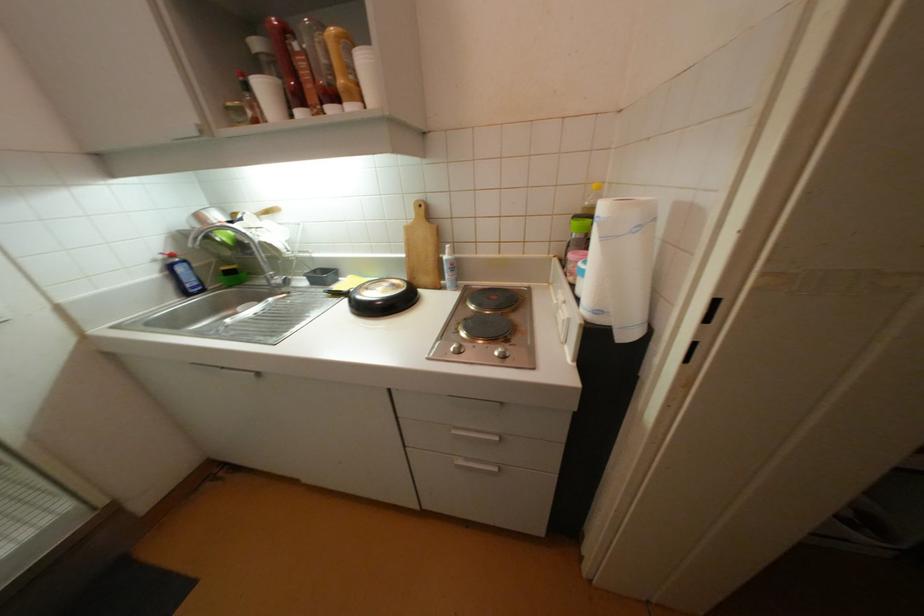
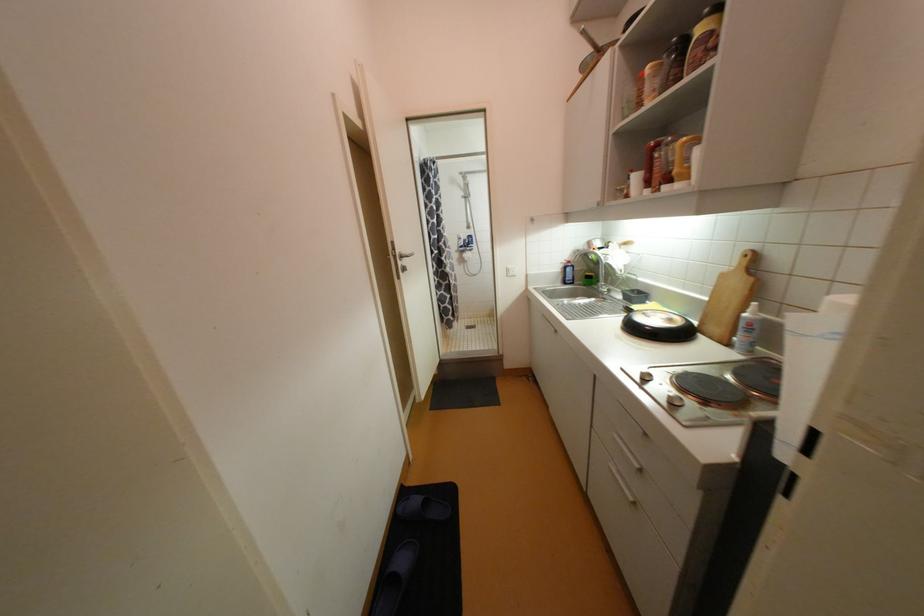
The point at [324,291] is marked in the first image. Where is the corresponding point in the second image?

(628, 305)